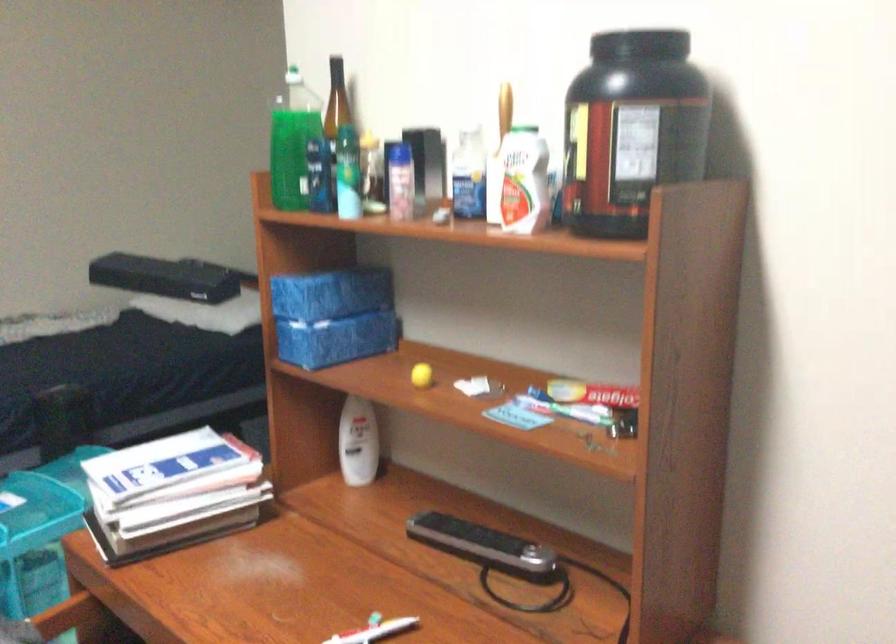
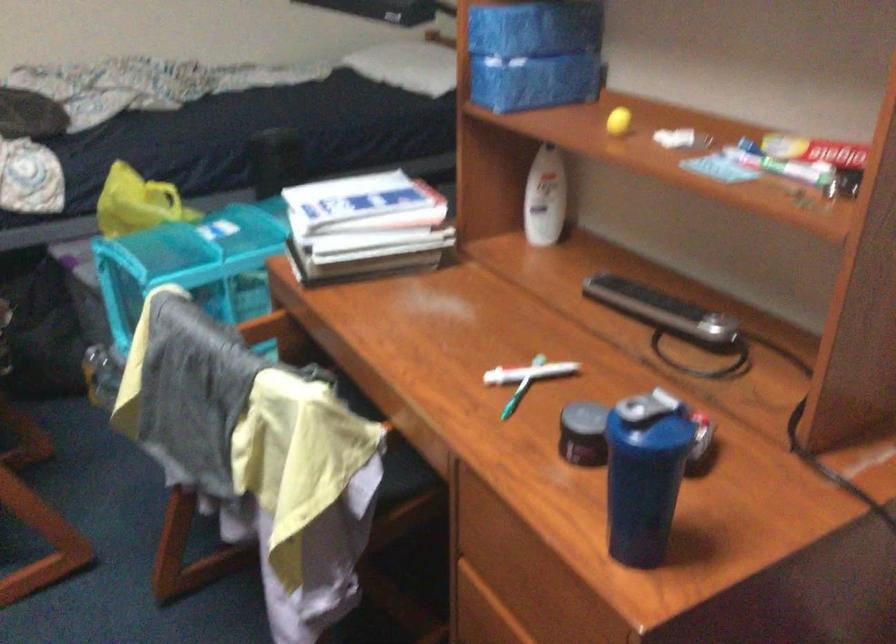
The point at (357, 440) is marked in the first image. Where is the corresponding point in the second image?

(545, 198)